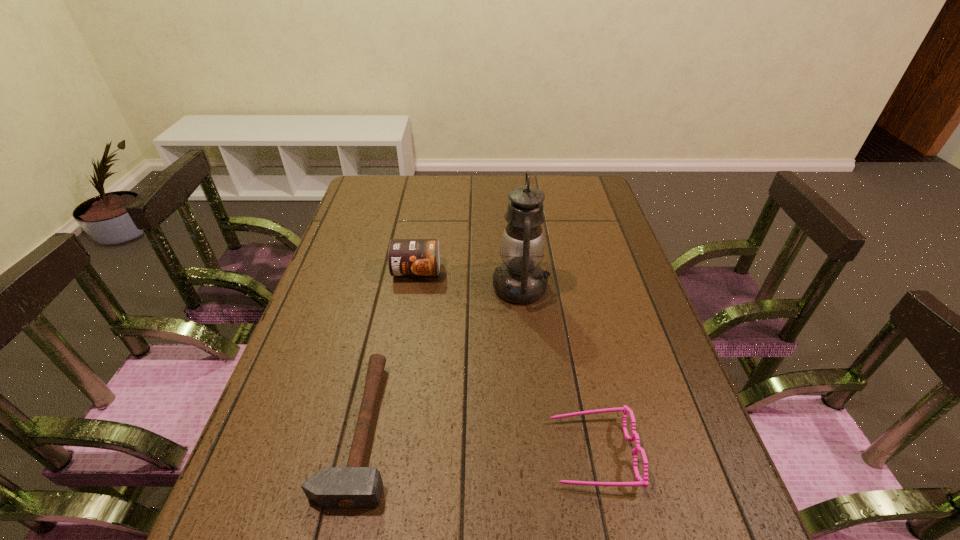
I want to click on vacant region that satisfies the following two spatial constraints: 1. on the front label of the can; 2. on the striking surface of the shortest object, so click(x=390, y=429).

Image resolution: width=960 pixels, height=540 pixels. I want to click on free spot that satisfies the following two spatial constraints: 1. on the front label of the can; 2. on the striking surface of the hammer, so click(390, 429).

The height and width of the screenshot is (540, 960). Identify the location of free space that satisfies the following two spatial constraints: 1. on the front label of the oil lamp; 2. on the right side of the second tallest object. (414, 287).